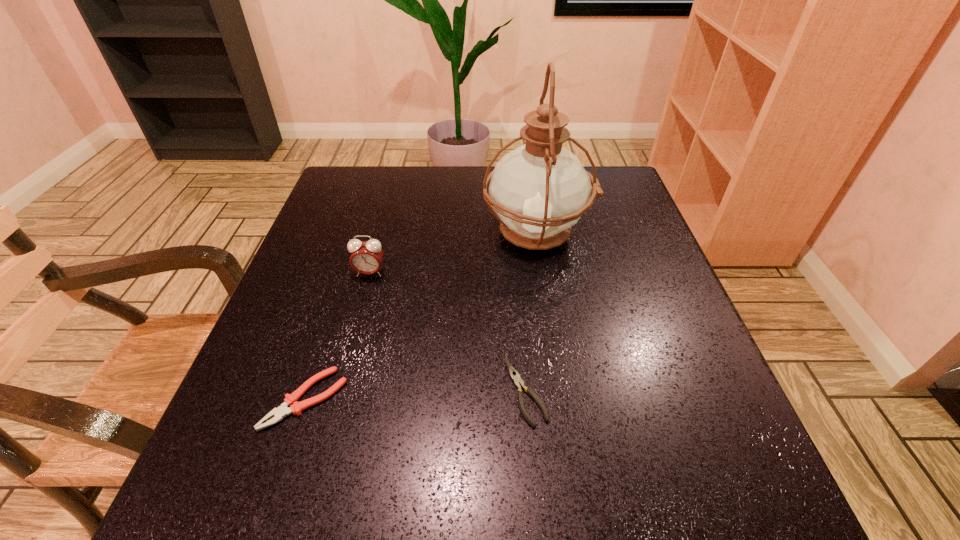
What are the coordinates of `oil lamp` in the screenshot? It's located at (539, 190).

Image resolution: width=960 pixels, height=540 pixels. In order to click on alarm clock in this screenshot , I will do `click(366, 258)`.

The width and height of the screenshot is (960, 540). Find the location of `the left pliers`. the left pliers is located at coordinates (280, 412).

The image size is (960, 540). In order to click on the right pliers in this screenshot , I will do `click(513, 373)`.

The width and height of the screenshot is (960, 540). In order to click on vacant region located 0.170m on the left of the oil lamp in this screenshot , I will do `click(411, 234)`.

At what (x,y) coordinates should I click in order to perform the action: click on free region located 0.320m on the clock face of the alarm clock. Please return your answer as a coordinate pair (x, y). This screenshot has height=540, width=960. Looking at the image, I should click on (331, 416).

Locate an element on the screen. This screenshot has height=540, width=960. vacant space situated 0.260m on the right of the left pliers is located at coordinates (501, 399).

At what (x,y) coordinates should I click in order to perform the action: click on free point located on the back of the right pliers. Please return your answer as a coordinate pair (x, y). The image size is (960, 540). Looking at the image, I should click on (512, 232).

This screenshot has width=960, height=540. Identify the location of object located at the far edge. (539, 190).

Locate an element on the screen. alarm clock located at the left edge is located at coordinates (366, 258).